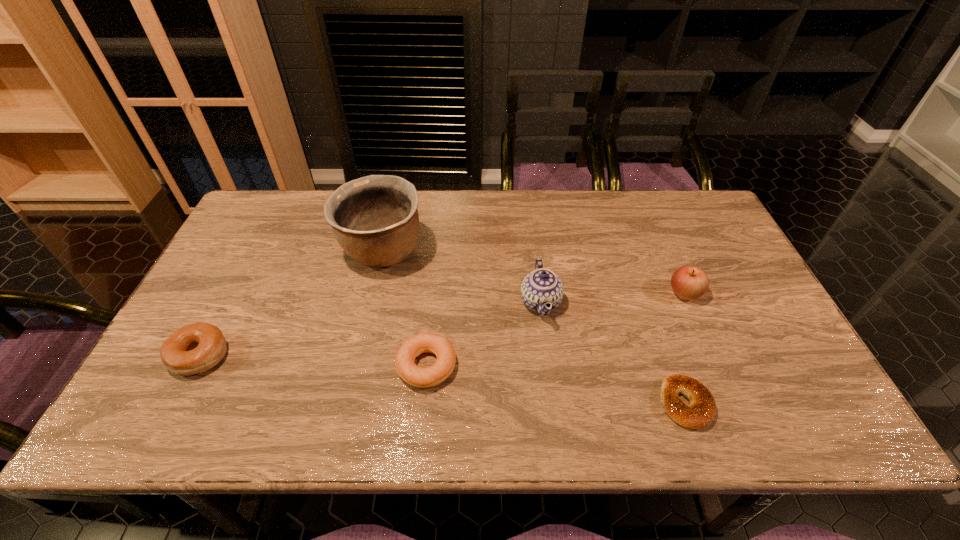
Where is `free space that satisfies the following two spatial constraints: 1. on the front side of the rightmost bagel; 2. on the left side of the leftmost object`? This screenshot has width=960, height=540. free space that satisfies the following two spatial constraints: 1. on the front side of the rightmost bagel; 2. on the left side of the leftmost object is located at coordinates (176, 403).

Locate an element on the screen. This screenshot has width=960, height=540. free region that satisfies the following two spatial constraints: 1. on the back side of the pottery; 2. on the right side of the tallest bagel is located at coordinates (254, 252).